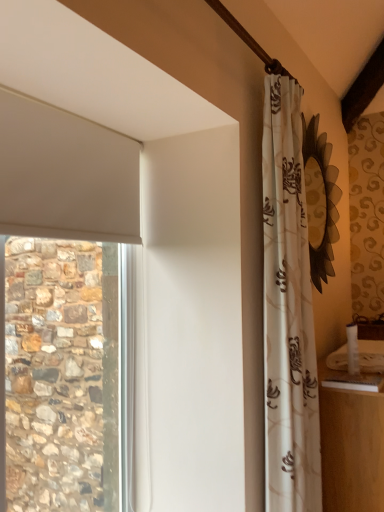
Question: Should I look upward or downward to see white glossy counter top at lower right?

Choices:
 (A) down
 (B) up

Answer: (A)

Question: Is floral-patterned fabric curtain at right facing towards white glossy counter top at lower right?

Choices:
 (A) no
 (B) yes

Answer: (B)

Question: From the image's perspective, is floral-patterned fabric curtain at right above white glossy counter top at lower right?

Choices:
 (A) no
 (B) yes

Answer: (B)

Question: Is floral-patterned fabric curtain at right bigger than white glossy counter top at lower right?

Choices:
 (A) no
 (B) yes

Answer: (B)

Question: Is white glossy counter top at lower right a part of floral-patterned fabric curtain at right?

Choices:
 (A) no
 (B) yes

Answer: (A)

Question: Is floral-patterned fabric curtain at right beside white glossy counter top at lower right?

Choices:
 (A) no
 (B) yes

Answer: (A)

Question: From a real-world perspective, is floral-patterned fabric curtain at right on white glossy counter top at lower right?

Choices:
 (A) no
 (B) yes

Answer: (B)

Question: Could you tell me if white glossy counter top at lower right is turned towards floral-patterned fabric curtain at right?

Choices:
 (A) no
 (B) yes

Answer: (A)

Question: Is white glossy counter top at lower right outside of floral-patterned fabric curtain at right?

Choices:
 (A) no
 (B) yes

Answer: (B)

Question: Is white glossy counter top at lower right to the right of floral-patterned fabric curtain at right from the viewer's perspective?

Choices:
 (A) yes
 (B) no

Answer: (A)

Question: From a real-world perspective, is white glossy counter top at lower right positioned under floral-patterned fabric curtain at right based on gravity?

Choices:
 (A) yes
 (B) no

Answer: (A)

Question: Can you confirm if white glossy counter top at lower right is wider than floral-patterned fabric curtain at right?

Choices:
 (A) yes
 (B) no

Answer: (A)

Question: From the image's perspective, is white glossy counter top at lower right located beneath floral-patterned fabric curtain at right?

Choices:
 (A) yes
 (B) no

Answer: (A)

Question: Relative to floral-patterned fabric curtain at right, is white glossy counter top at lower right in front or behind?

Choices:
 (A) front
 (B) behind

Answer: (B)